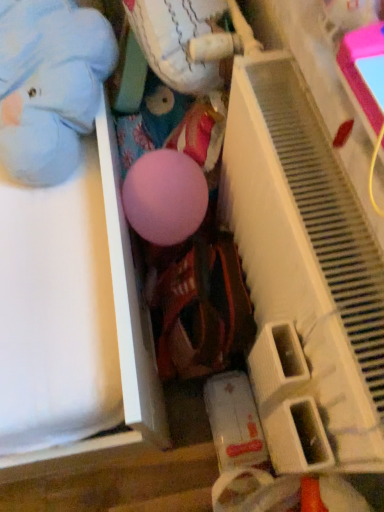
In order to face soft blue plush elephant at upper left, should I rotate leftwards or rightwards?

Rotate left and turn 19.269 degrees.

What is the approximate width of soft blue plush elephant at upper left?

15.39 inches.

This screenshot has width=384, height=512. Describe the element at coordinates (49, 85) in the screenshot. I see `soft blue plush elephant at upper left` at that location.

Image resolution: width=384 pixels, height=512 pixels. What are the coordinates of `soft blue plush elephant at upper left` in the screenshot? It's located at (49, 85).

I want to click on soft blue plush elephant at upper left, so click(x=49, y=85).